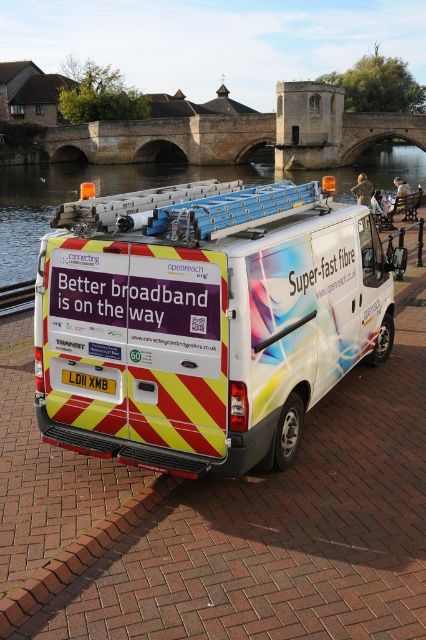
Who is shorter, white glossy van at center or brown stone bridge at center?

Standing shorter between the two is white glossy van at center.

Does white glossy van at center come behind brown stone bridge at center?

No, white glossy van at center is closer to the viewer.

Does point (374, 296) lie behind point (71, 154)?

No, (374, 296) is closer to viewer.

Find the location of `white glossy van at center`. white glossy van at center is located at coordinates (207, 326).

Is point (54, 147) positioned in front of point (14, 627)?

That is False.

Which of these two, brown stone bridge at center or brick at lower left, stands taller?

brown stone bridge at center is taller.

This screenshot has height=640, width=426. I want to click on brown stone bridge at center, so click(x=224, y=138).

Is brick at lower left positioned before metallic rail at lower left?

Yes, it is in front of metallic rail at lower left.

Which is below, brick at lower left or metallic rail at lower left?

brick at lower left is lower down.

Image resolution: width=426 pixels, height=640 pixels. Find the location of `brick at lower left`. brick at lower left is located at coordinates (80, 554).